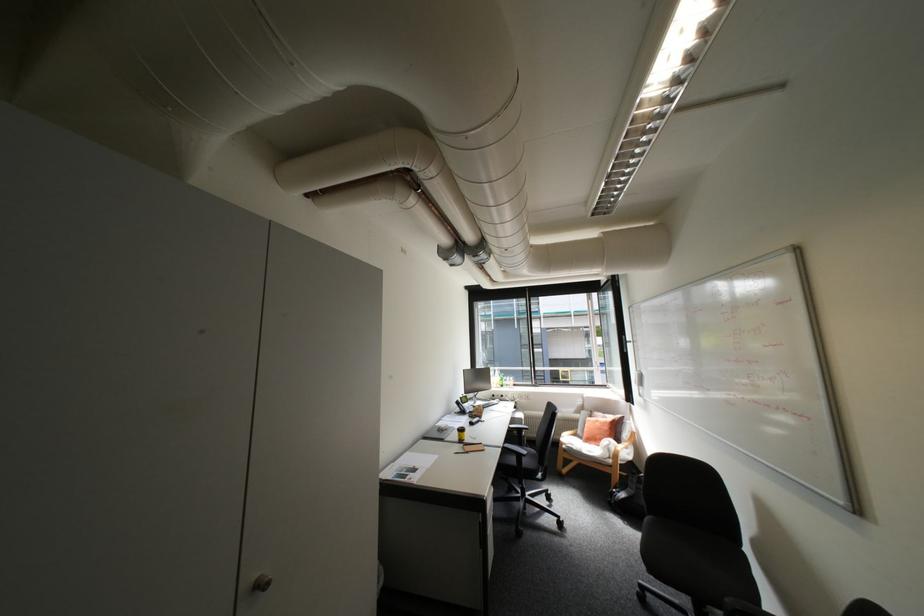
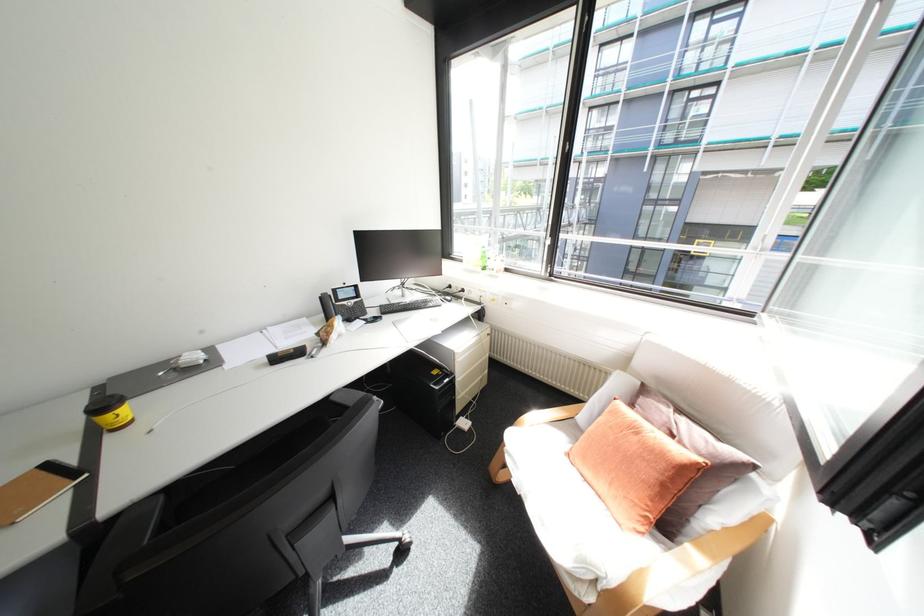
In the second image, find the point that corresponds to (611,415) in the first image.

(677, 410)